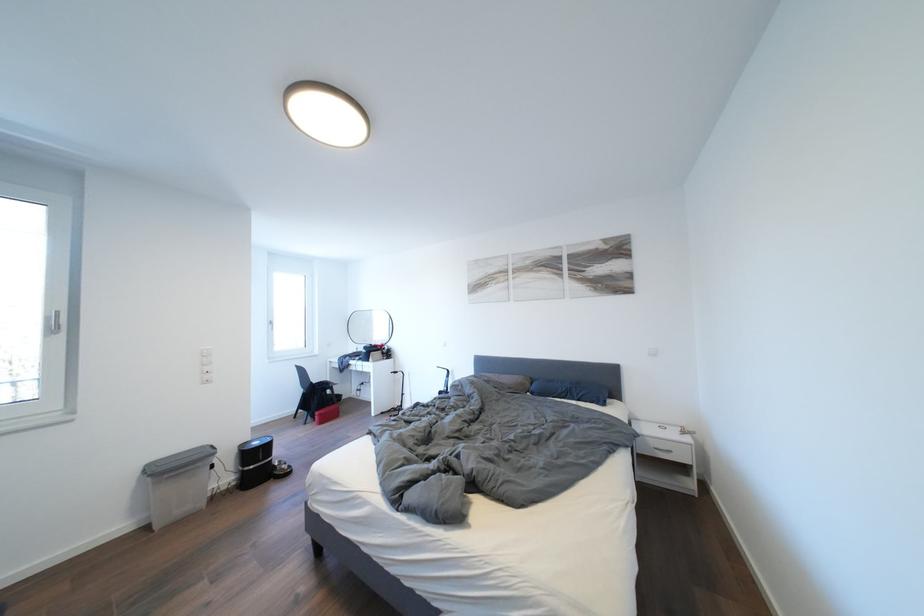
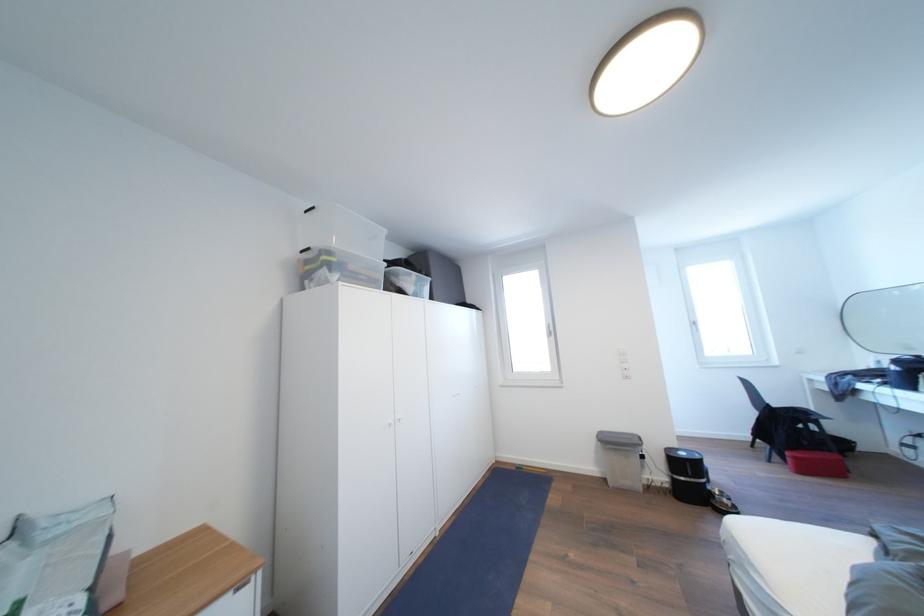
The point at (263, 448) is marked in the first image. Where is the corresponding point in the second image?

(689, 459)